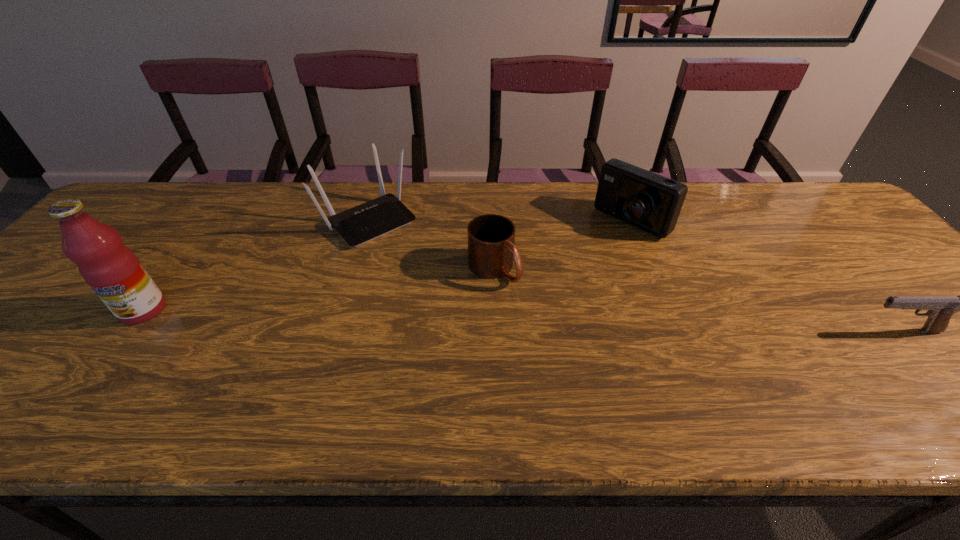
Find the location of a particular element. The width and height of the screenshot is (960, 540). the tallest object is located at coordinates (111, 269).

Locate an element on the screen. fruit juice is located at coordinates (111, 269).

Find the location of a particular element. The width and height of the screenshot is (960, 540). the nearest object is located at coordinates (940, 309).

You are a GUI agent. You are given a task and a screenshot of the screen. Output one action in this format:
    pyautogui.click(x=<x>, y=<y>)
    Task: Click on the rightmost object
    This screenshot has width=960, height=540.
    Given the screenshot: What is the action you would take?
    pyautogui.click(x=940, y=309)

At what (x,y) coordinates should I click in order to perform the action: click on router. Please return your answer as a coordinate pair (x, y). The image size is (960, 540). Looking at the image, I should click on (363, 223).

This screenshot has height=540, width=960. What are the coordinates of `the fourth object from left to right` in the screenshot? It's located at (646, 200).

The width and height of the screenshot is (960, 540). I want to click on the third object from right to left, so click(x=491, y=237).

Find the location of `free space located on the label of the fourth farthest object`. free space located on the label of the fourth farthest object is located at coordinates (95, 376).

At what (x,y) coordinates should I click in order to perform the action: click on free space located 0.310m at the barrel of the rightmost object. Please return your answer as a coordinate pair (x, y). The width and height of the screenshot is (960, 540). Looking at the image, I should click on (723, 331).

In order to click on free point located at the barrel of the rightmost object in this screenshot , I will do `click(692, 331)`.